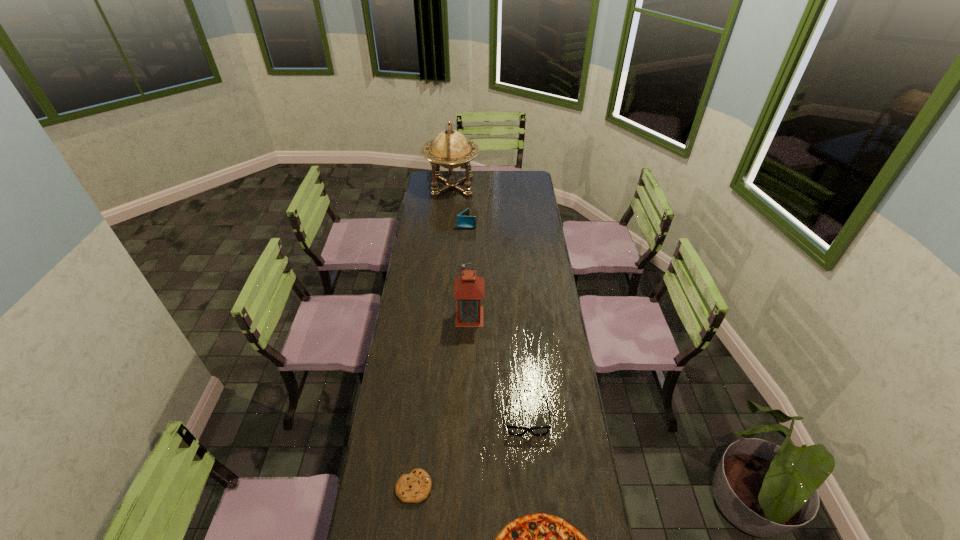
The image size is (960, 540). Find the location of `the tallest object`. the tallest object is located at coordinates (450, 149).

Find the location of a particular element. This screenshot has height=540, width=960. globe is located at coordinates (450, 149).

This screenshot has height=540, width=960. I want to click on the sixth shortest object, so click(469, 288).

Find the location of a particular element. The image size is (960, 540). the fourth nearest object is located at coordinates (469, 288).

Identify the location of igniter. The width and height of the screenshot is (960, 540). (462, 265).

Image resolution: width=960 pixels, height=540 pixels. Find the location of `the sixth nearest object`. the sixth nearest object is located at coordinates tap(464, 221).

Where is `the third nearest object`? This screenshot has width=960, height=540. the third nearest object is located at coordinates (513, 430).

Identify the location of sunglasses. (513, 430).

This screenshot has height=540, width=960. What are the coordinates of `the sixth tallest object` in the screenshot? It's located at (414, 487).

The height and width of the screenshot is (540, 960). In order to click on the sixth farthest object in this screenshot , I will do `click(414, 487)`.